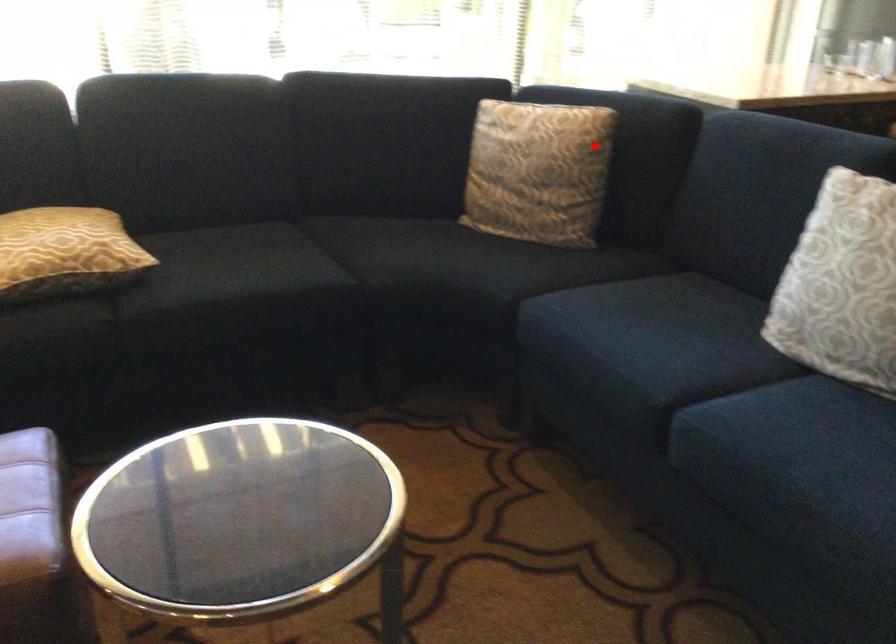
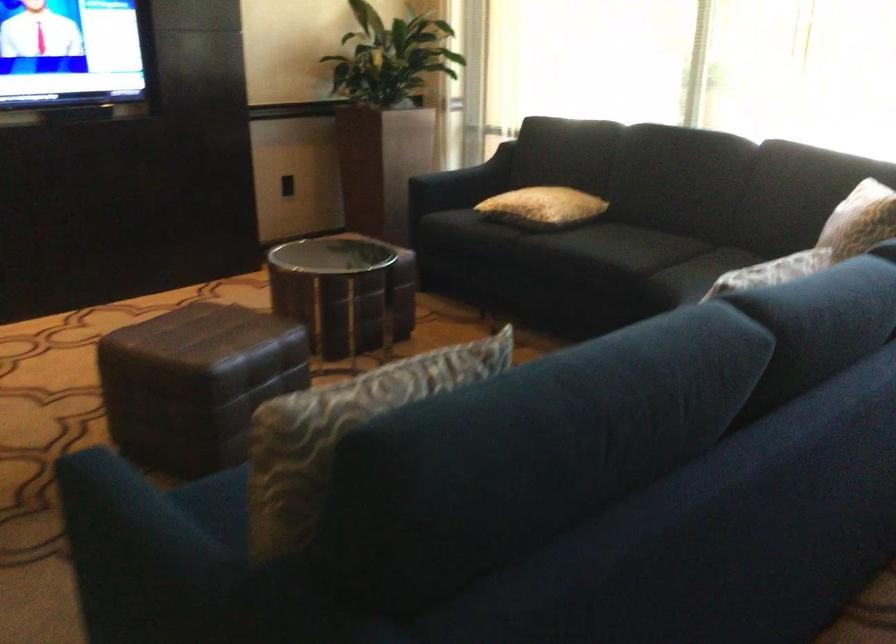
In the second image, find the point that corresponds to the highlighted location in the first image.

(859, 220)